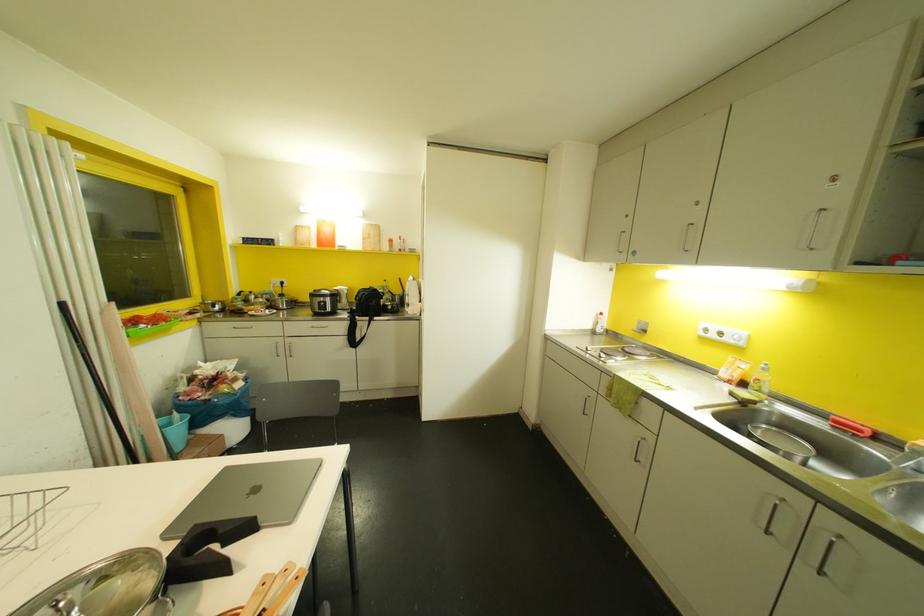
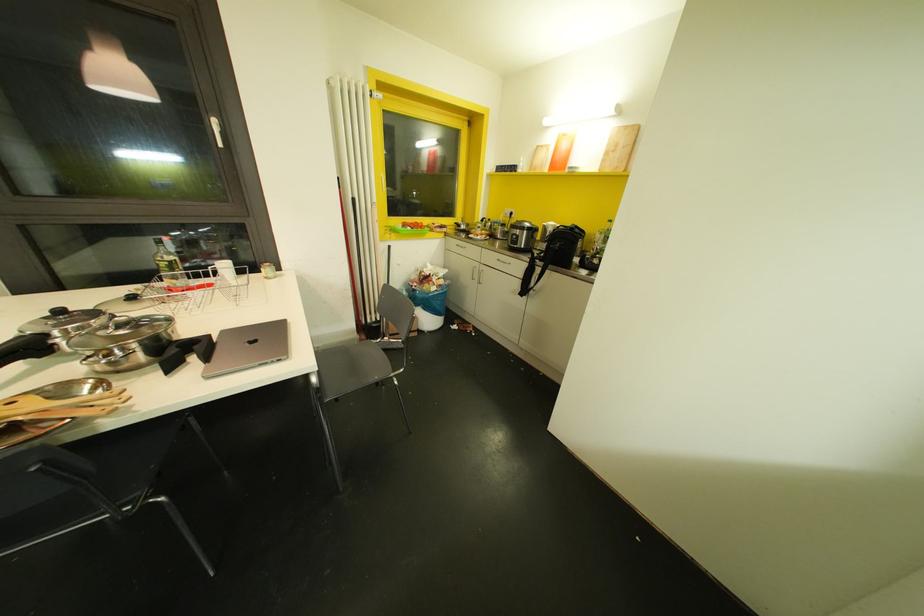
Find the pixel in the second image that matches point 368,249 in the first image.

(606, 169)